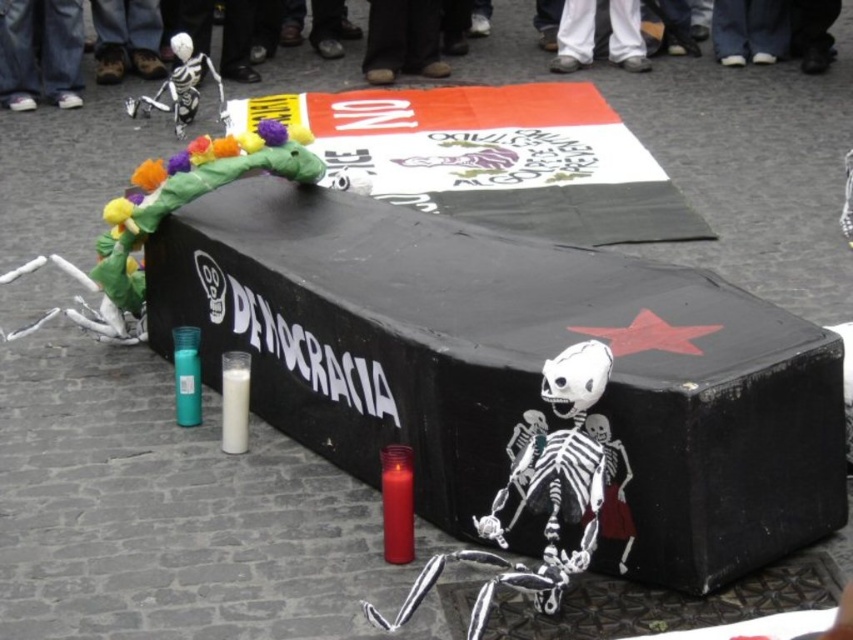
Question: Which point is farther to the camera?

Choices:
 (A) (131, 44)
 (B) (575, 32)
 (C) (80, 54)

Answer: (B)

Question: Does jeans at upper left appear on the left side of white pants at upper center?

Choices:
 (A) yes
 (B) no

Answer: (A)

Question: Does brown leather shoes at upper left appear on the right side of white pants at upper center?

Choices:
 (A) no
 (B) yes

Answer: (A)

Question: Considering the real-world distances, which object is farthest from the white plastic skeleton at upper center?

Choices:
 (A) jeans at upper left
 (B) brown leather shoes at upper left
 (C) white pants at upper center

Answer: (A)

Question: Can you confirm if white plastic skeleton at upper center is smaller than brown leather shoes at upper left?

Choices:
 (A) no
 (B) yes

Answer: (A)

Question: Among these objects, which one is farthest from the camera?

Choices:
 (A) white plastic skeleton at upper center
 (B) white pants at upper center
 (C) jeans at upper left

Answer: (B)